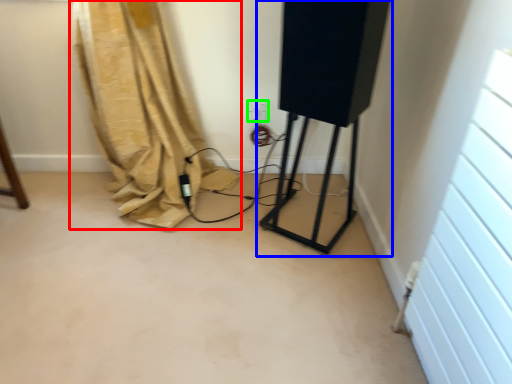
Question: Based on their relative distances, which object is nearer to curtain (highlighted by a red box)? Choose from equipment (highlighted by a blue box) and electric outlet (highlighted by a green box).

Choices:
 (A) equipment
 (B) electric outlet

Answer: (B)